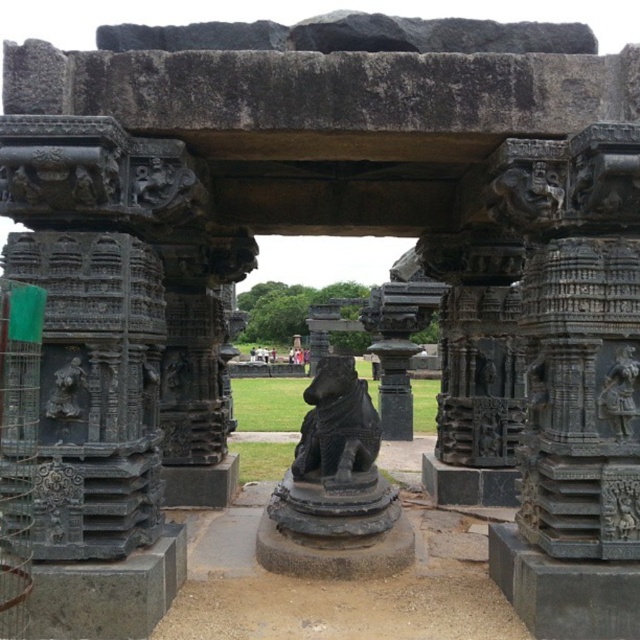
Question: Is the position of black stone statue at center less distant than that of dark gray stone statue at center?

Choices:
 (A) yes
 (B) no

Answer: (B)

Question: Considering the real-world distances, which object is closest to the dark gray stone carving at center?

Choices:
 (A) dark gray stone lion at left
 (B) dark gray stone statue at center

Answer: (B)

Question: Which of the following is the closest to the observer?

Choices:
 (A) (625, 522)
 (B) (634, 371)

Answer: (A)

Question: Does black stone statue at center appear over dark gray stone statue at center?

Choices:
 (A) yes
 (B) no

Answer: (B)

Question: Can you confirm if dark gray stone carving at center is thinner than dark gray stone lion at left?

Choices:
 (A) yes
 (B) no

Answer: (A)

Question: Among these points, which one is nearest to the camera?

Choices:
 (A) (346, 449)
 (B) (600, 412)
 (C) (604, 484)

Answer: (C)